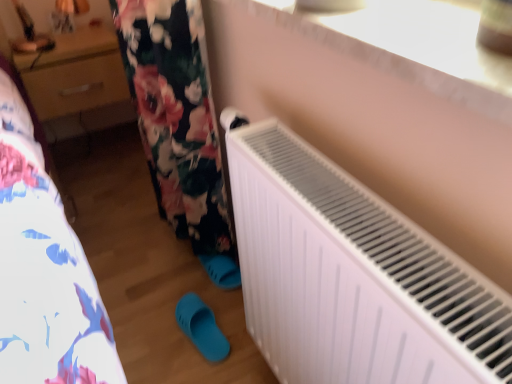
Question: From the image's perspective, does white matte radiator at lower right appear higher than matte plastic slipper at lower center?

Choices:
 (A) yes
 (B) no

Answer: (A)

Question: Can you confirm if white matte radiator at lower right is positioned to the left of matte plastic slipper at lower center?

Choices:
 (A) no
 (B) yes

Answer: (A)

Question: Is white matte radiator at lower right turned away from matte plastic slipper at lower center?

Choices:
 (A) no
 (B) yes

Answer: (A)

Question: Is matte plastic slipper at lower center surrounded by white matte radiator at lower right?

Choices:
 (A) yes
 (B) no

Answer: (B)

Question: Is white matte radiator at lower right to the right of matte plastic slipper at lower center from the viewer's perspective?

Choices:
 (A) yes
 (B) no

Answer: (A)

Question: From a real-world perspective, is wooden drawer at upper left above or below white plastic radiator at upper right?

Choices:
 (A) below
 (B) above

Answer: (A)

Question: In terms of width, does wooden drawer at upper left look wider or thinner when compared to white plastic radiator at upper right?

Choices:
 (A) thin
 (B) wide

Answer: (B)

Question: In the image, is wooden drawer at upper left on the left side or the right side of white plastic radiator at upper right?

Choices:
 (A) left
 (B) right

Answer: (A)

Question: In terms of size, does wooden drawer at upper left appear bigger or smaller than white plastic radiator at upper right?

Choices:
 (A) small
 (B) big

Answer: (B)

Question: Would you say matte plastic slipper at lower center is to the left or to the right of wooden drawer at upper left in the picture?

Choices:
 (A) right
 (B) left

Answer: (A)

Question: In the image, is matte plastic slipper at lower center positioned in front of or behind wooden drawer at upper left?

Choices:
 (A) front
 (B) behind

Answer: (A)

Question: Is point (200, 304) positioned closer to the camera than point (76, 94)?

Choices:
 (A) closer
 (B) farther

Answer: (A)

Question: In terms of size, does matte plastic slipper at lower center appear bigger or smaller than wooden drawer at upper left?

Choices:
 (A) big
 (B) small

Answer: (B)

Question: From the image's perspective, is white plastic radiator at upper right above or below white matte radiator at lower right?

Choices:
 (A) above
 (B) below

Answer: (A)

Question: Considering the positions of point (400, 39) and point (239, 233), is point (400, 39) closer or farther from the camera than point (239, 233)?

Choices:
 (A) farther
 (B) closer

Answer: (B)